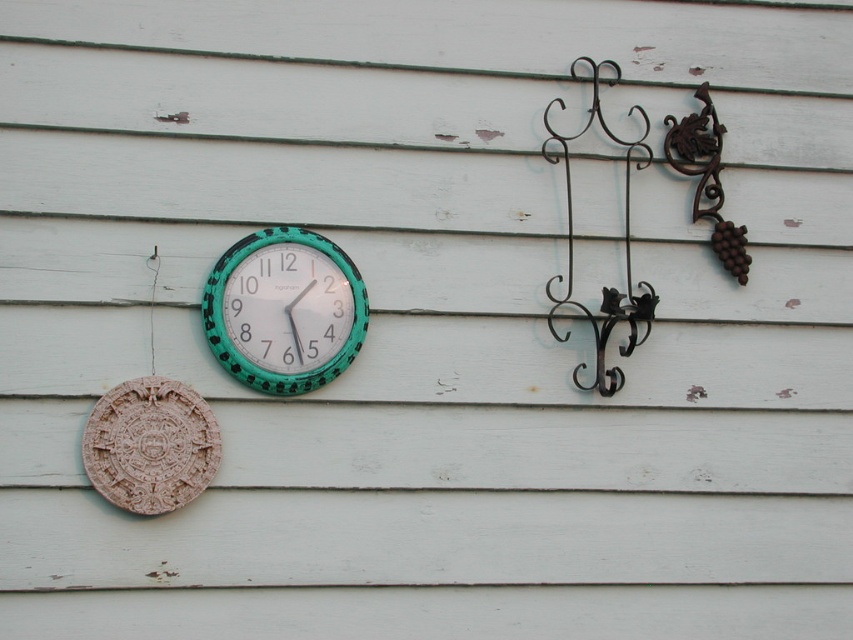
Question: Which point is farther to the camera?

Choices:
 (A) (346, 316)
 (B) (556, 154)
 (C) (161, 401)
 (D) (701, 157)

Answer: (D)

Question: Is teal painted metal clock at center thinner than carved stone plaque at lower left?

Choices:
 (A) no
 (B) yes

Answer: (A)

Question: Is teal painted metal clock at center positioned at the back of carved stone plaque at lower left?

Choices:
 (A) no
 (B) yes

Answer: (B)

Question: Can you confirm if black wrought iron hook at upper right is bigger than rusty wrought iron hook at upper right?

Choices:
 (A) no
 (B) yes

Answer: (B)

Question: Which object is positioned farthest from the teal painted metal clock at center?

Choices:
 (A) rusty wrought iron hook at upper right
 (B) carved stone plaque at lower left

Answer: (A)

Question: Which of the following is the closest to the observer?

Choices:
 (A) carved stone plaque at lower left
 (B) teal painted metal clock at center
 (C) black wrought iron hook at upper right

Answer: (A)